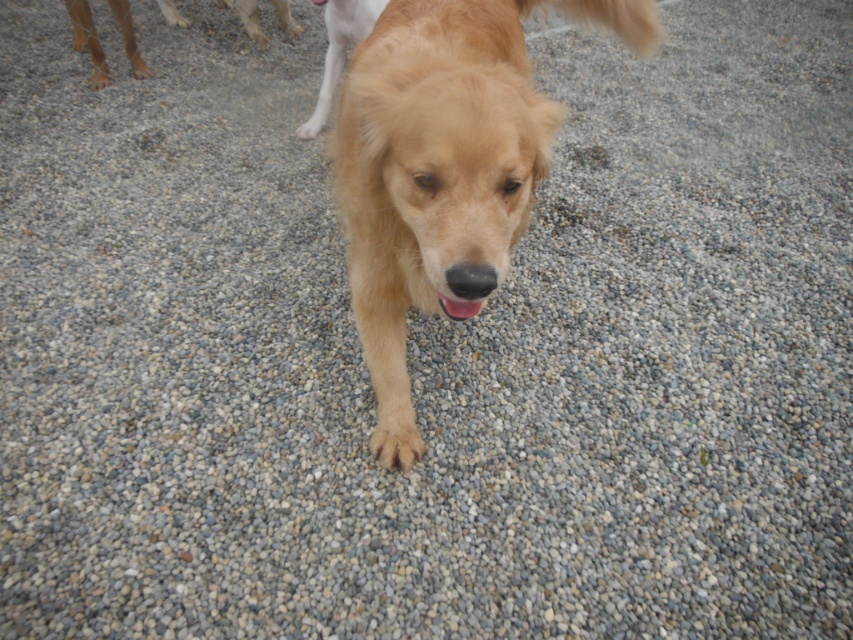
Question: Does golden fur dog at center appear under golden fur dog at upper left?

Choices:
 (A) yes
 (B) no

Answer: (A)

Question: Is golden fur dog at center further to camera compared to golden fur dog at upper left?

Choices:
 (A) yes
 (B) no

Answer: (B)

Question: Which of the following is the closest to the observer?

Choices:
 (A) (96, 33)
 (B) (352, 134)

Answer: (B)

Question: Does golden fur dog at center have a larger size compared to golden fur dog at upper left?

Choices:
 (A) no
 (B) yes

Answer: (B)

Question: Which object is closer to the camera taking this photo?

Choices:
 (A) golden fur dog at upper left
 (B) golden fur dog at center

Answer: (B)